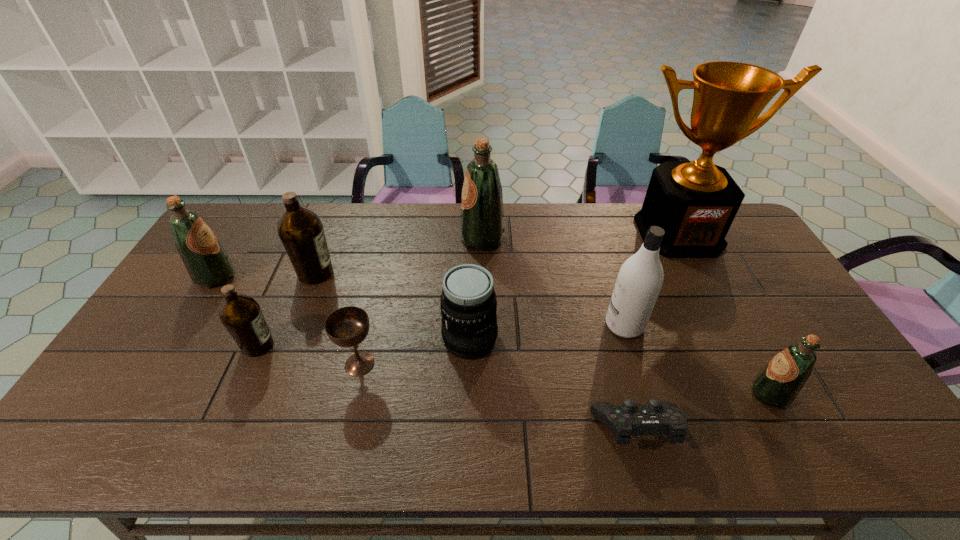
Locate an element on the screen. the nearest olive oil is located at coordinates (778, 384).

You are a GUI agent. You are given a task and a screenshot of the screen. Output one action in this format:
    pyautogui.click(x=<x>, y=<y>)
    Task: Click on the nearer brown olive oil
    Image resolution: width=960 pixels, height=540 pixels.
    Given the screenshot: What is the action you would take?
    pyautogui.click(x=241, y=315)

At what (x,y) coordinates should I click in order to perform the action: click on the smaller brown olive oil. Please return your answer as a coordinate pair (x, y). This screenshot has width=960, height=540. Looking at the image, I should click on (241, 315).

Locate an element on the screen. This screenshot has width=960, height=540. the second shortest object is located at coordinates (346, 327).

The height and width of the screenshot is (540, 960). In order to click on the seventh object from right to left in this screenshot , I will do `click(346, 327)`.

This screenshot has height=540, width=960. In order to click on control in this screenshot , I will do `click(656, 417)`.

Where is `vacant region located 0.400m on the front of the trophy cup with the label`? This screenshot has height=540, width=960. vacant region located 0.400m on the front of the trophy cup with the label is located at coordinates [742, 356].

The width and height of the screenshot is (960, 540). Find the location of `free space located 0.160m on the front-facing side of the farthest green olive oil`. free space located 0.160m on the front-facing side of the farthest green olive oil is located at coordinates (415, 239).

Identify the location of vacant area situated 0.340m on the front-facing side of the farthest green olive oil. This screenshot has height=540, width=960. (364, 239).

I want to click on vacant space located 0.190m on the front-facing side of the farthest green olive oil, so click(x=406, y=239).